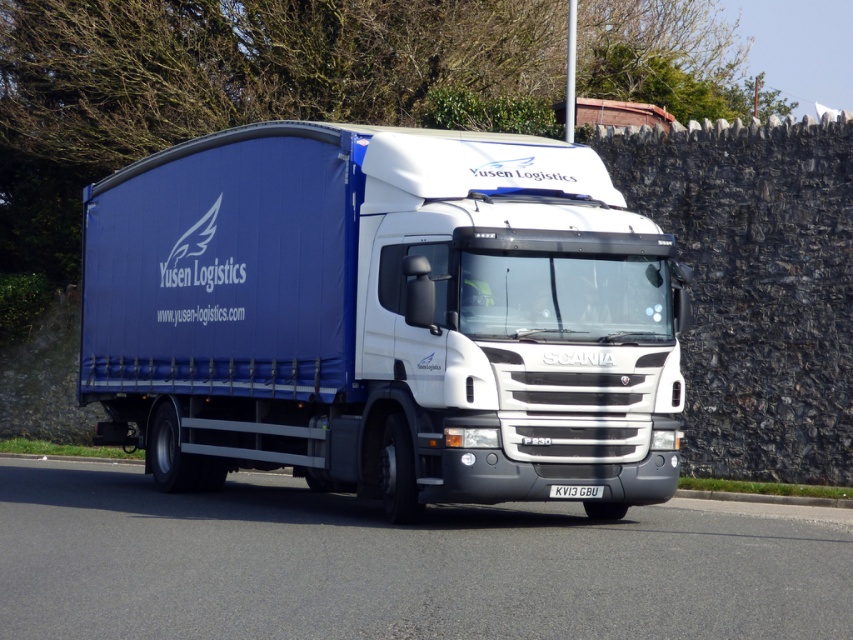
Is black asphalt road at center shorter than white plastic license plate at center?

In fact, black asphalt road at center may be taller than white plastic license plate at center.

Describe the element at coordinates (399, 564) in the screenshot. I see `black asphalt road at center` at that location.

Between point (650, 605) and point (585, 492), which one is positioned in front?

Positioned in front is point (650, 605).

Find the location of `black asphalt road at center`. black asphalt road at center is located at coordinates (399, 564).

Between blue fabric truck at center and white plastic license plate at center, which one has more height?

With more height is blue fabric truck at center.

Can you confirm if blue fabric truck at center is bigger than white plastic license plate at center?

Correct, blue fabric truck at center is larger in size than white plastic license plate at center.

What do you see at coordinates (386, 316) in the screenshot?
I see `blue fabric truck at center` at bounding box center [386, 316].

I want to click on blue fabric truck at center, so click(x=386, y=316).

Looking at this image, is blue fabric truck at center to the left of black asphalt road at center from the viewer's perspective?

Indeed, blue fabric truck at center is positioned on the left side of black asphalt road at center.

Who is shorter, blue fabric truck at center or black asphalt road at center?

black asphalt road at center is shorter.

Between point (277, 132) and point (796, 593), which one is positioned behind?

Point (277, 132)

The height and width of the screenshot is (640, 853). Find the location of `blue fabric truck at center`. blue fabric truck at center is located at coordinates (386, 316).